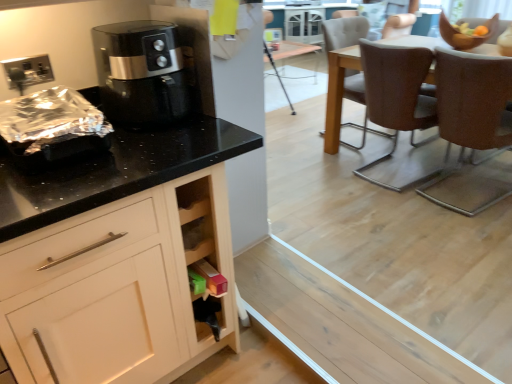
Question: From a real-world perspective, is brown leather chair at right, positioned as the 3th chair in back-to-front order, located higher than black glossy air fryer at upper left?

Choices:
 (A) yes
 (B) no

Answer: (B)

Question: From a real-world perspective, is brown leather chair at right, positioned as the 3th chair in back-to-front order, beneath black glossy air fryer at upper left?

Choices:
 (A) yes
 (B) no

Answer: (A)

Question: Is brown leather chair at right, which is the 1th chair from front to back, to the left of black glossy air fryer at upper left from the viewer's perspective?

Choices:
 (A) no
 (B) yes

Answer: (A)

Question: From the image's perspective, would you say brown leather chair at right, which is the 1th chair from front to back, is shown under black glossy air fryer at upper left?

Choices:
 (A) no
 (B) yes

Answer: (B)

Question: Is brown leather chair at right, which is the 1th chair from front to back, next to black glossy air fryer at upper left and touching it?

Choices:
 (A) no
 (B) yes

Answer: (A)

Question: Do you think black glossy air fryer at upper left is within brown textured chair at right, placed as the third chair when sorted from front to back, or outside of it?

Choices:
 (A) inside
 (B) outside

Answer: (B)

Question: Looking at the image, does black glossy air fryer at upper left seem bigger or smaller compared to brown textured chair at right, acting as the 1th chair starting from the back?

Choices:
 (A) small
 (B) big

Answer: (A)

Question: In the image, is black glossy air fryer at upper left on the left side or the right side of brown textured chair at right, acting as the 1th chair starting from the back?

Choices:
 (A) right
 (B) left

Answer: (B)

Question: In the image, is black glossy air fryer at upper left positioned in front of or behind brown textured chair at right, acting as the 1th chair starting from the back?

Choices:
 (A) front
 (B) behind

Answer: (A)

Question: Does point (99, 44) appear closer or farther from the camera than point (205, 317)?

Choices:
 (A) closer
 (B) farther

Answer: (A)

Question: From the image's perspective, is black glossy air fryer at upper left located above or below wooden cabinet at lower center?

Choices:
 (A) above
 (B) below

Answer: (A)

Question: Considering the positions of black glossy air fryer at upper left and wooden cabinet at lower center in the image, is black glossy air fryer at upper left taller or shorter than wooden cabinet at lower center?

Choices:
 (A) short
 (B) tall

Answer: (A)

Question: Considering their positions, is black glossy air fryer at upper left located in front of or behind wooden cabinet at lower center?

Choices:
 (A) behind
 (B) front

Answer: (B)

Question: Is brown textured chair at right, placed as the third chair when sorted from front to back, inside the boundaries of brown leather chair at center, which is counted as the 2th chair, starting from the front, or outside?

Choices:
 (A) outside
 (B) inside

Answer: (A)

Question: Is point (389, 134) closer or farther from the camera than point (399, 71)?

Choices:
 (A) farther
 (B) closer

Answer: (A)